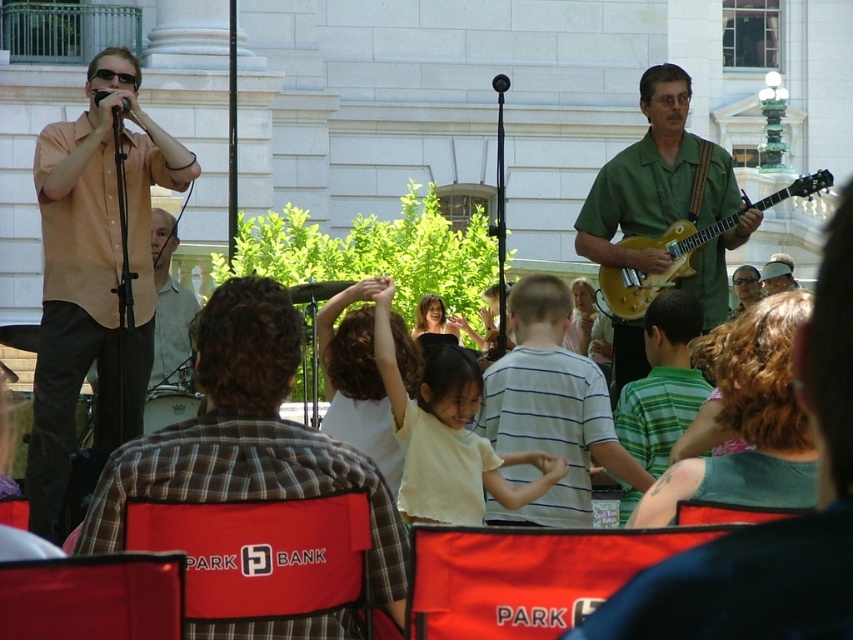
You are a photographer at the back of the audience, trying to capture a clear photo of both the smooth black hair at center and the matte green shirt at center. Since you can only adjust your camera to focus on one height, which object should you prioritize focusing on to ensure both are in focus?

The smooth black hair at center has a lesser height compared to matte green shirt at center. To ensure both are in focus, prioritize focusing on the matte green shirt at center since it is taller, allowing the camera to capture the lower smooth black hair at center within the depth of field.

Consider the image. You are standing at the camera position and want to know how far the point at coordinates (428, 308) is from you. Can you determine the distance?

The point at coordinates (428, 308) is 76.98 meters away from the camera.